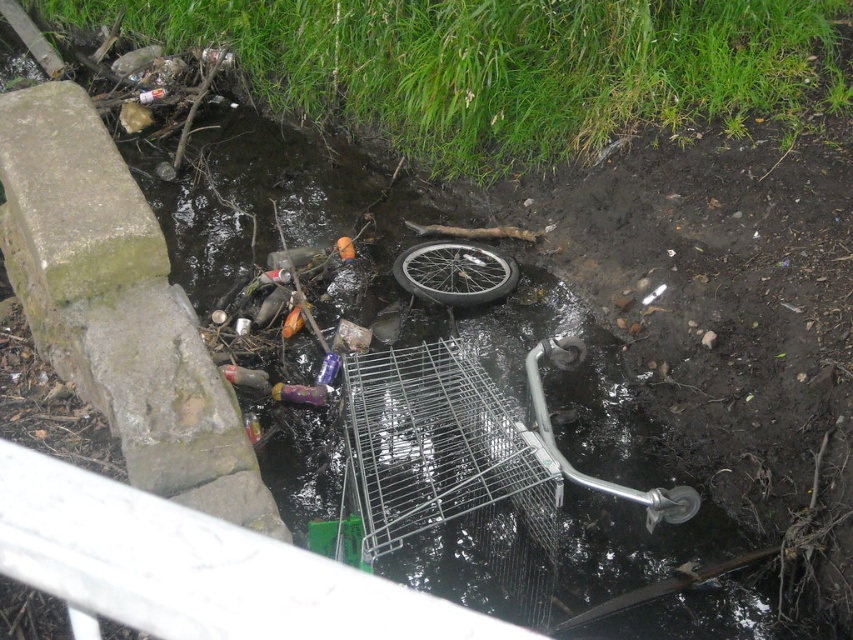
You are a waste collector who needs to remove the silver metallic cage at center and the metallic silver bicycle wheel at center from the polluted stream. Based on their sizes, which object should you prioritize removing first?

The silver metallic cage at center is taller than the metallic silver bicycle wheel at center, so you should prioritize removing the silver metallic cage at center first as it might be more obstructive or hazardous in the stream.

You are a photographer standing at the edge of the polluted stream. You want to capture a clear photo of both the silver metallic cage at center and the metallic silver bicycle wheel at center. Which object should you focus on first to ensure both are in focus?

You should focus on the silver metallic cage at center first because it is closer to the viewer, and adjusting focus from near to far will help ensure both objects are in focus.

You are standing at the edge of the polluted stream and want to pick up a piece of litter located at point [395,356]. Can you reach it without getting into the water?

The point [395,356] is 10.95 feet away from the camera, so you cannot reach it without getting into the water.